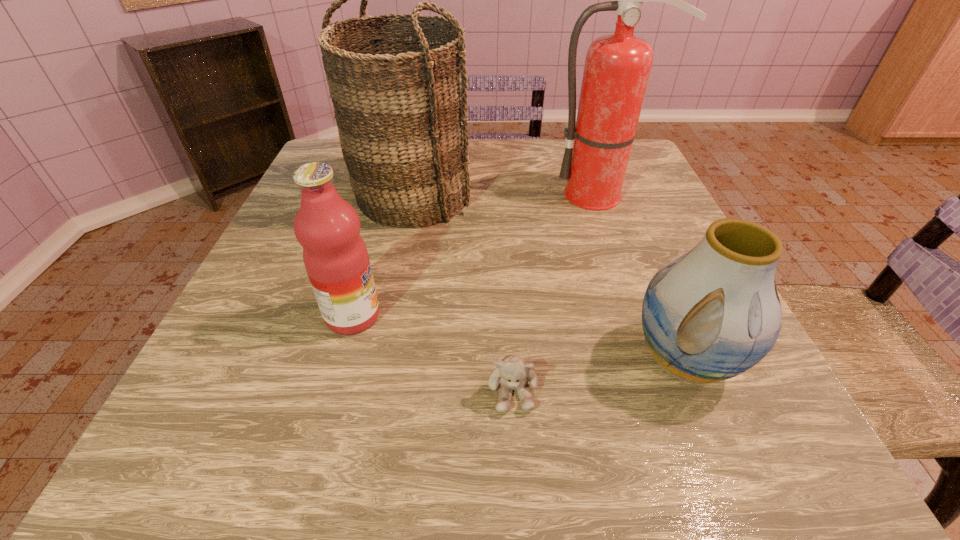
Where is `free space at the left edge of the desktop`? This screenshot has width=960, height=540. free space at the left edge of the desktop is located at coordinates (301, 268).

Identify the location of free spot at the right edge of the desktop. (664, 210).

I want to click on free space at the near right corner of the desktop, so click(x=727, y=439).

You are a GUI agent. You are given a task and a screenshot of the screen. Output one action in this format:
    pyautogui.click(x=<x>, y=<y>)
    Task: Click on the free area in between the fruit juice and the teddy bear
    The image size is (960, 540).
    Given the screenshot: What is the action you would take?
    pyautogui.click(x=433, y=353)

Locate an element on the screen. free space between the basket and the fruit juice is located at coordinates (382, 256).

Where is `free space between the third object from right to left and the fire extinguisher`? free space between the third object from right to left and the fire extinguisher is located at coordinates (557, 293).

You are a GUI agent. You are given a task and a screenshot of the screen. Output one action in this format:
    pyautogui.click(x=<x>, y=<y>)
    Task: Click on the vacant point located between the teddy bear and the fruit juice
    This screenshot has width=960, height=540.
    Given the screenshot: What is the action you would take?
    pyautogui.click(x=433, y=353)

Where is `empty location between the basket and the third object from right to left`? This screenshot has width=960, height=540. empty location between the basket and the third object from right to left is located at coordinates (463, 294).

You are a GUI agent. You are given a task and a screenshot of the screen. Output one action in this format:
    pyautogui.click(x=<x>, y=<y>)
    Task: Click on the vacant point located between the shortest object and the fourth tallest object
    This screenshot has height=540, width=960.
    Given the screenshot: What is the action you would take?
    pyautogui.click(x=598, y=375)

Where is `free spot between the basket and the fruit juice`? free spot between the basket and the fruit juice is located at coordinates (382, 256).